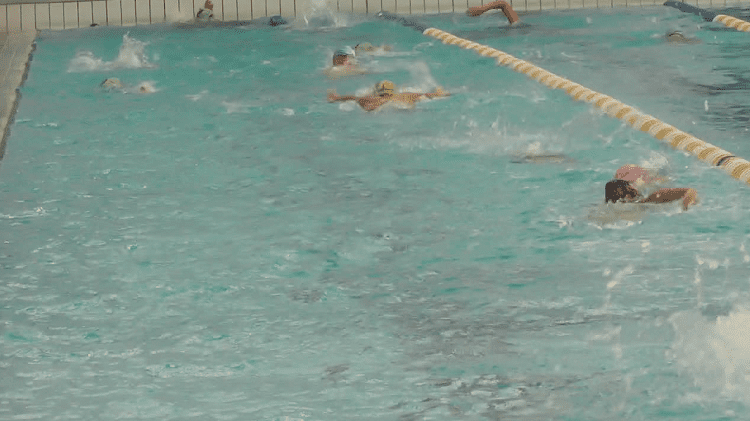
You are a GUI agent. You are given a task and a screenshot of the screen. Output one action in this format:
    pyautogui.click(x=<x>, y=<y>)
    Task: Click on the divider
    Image resolution: width=750 pixels, height=421 pixels.
    Given the screenshot: What is the action you would take?
    pyautogui.click(x=612, y=149)